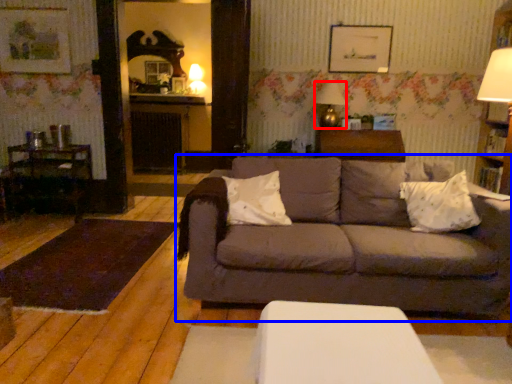
Question: Which of the following is the closest to the observer, table lamp (highlighted by a red box) or studio couch (highlighted by a blue box)?

Choices:
 (A) table lamp
 (B) studio couch

Answer: (B)